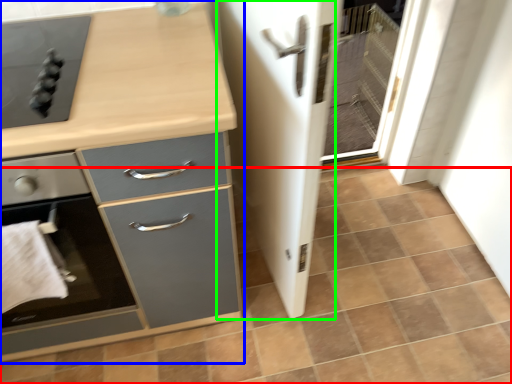
Question: Estimate the real-world distances between objects in this image. Which object is farther from tile (highlighted by a red box), chest of drawers (highlighted by a blue box) or screen door (highlighted by a green box)?

Choices:
 (A) chest of drawers
 (B) screen door

Answer: (A)